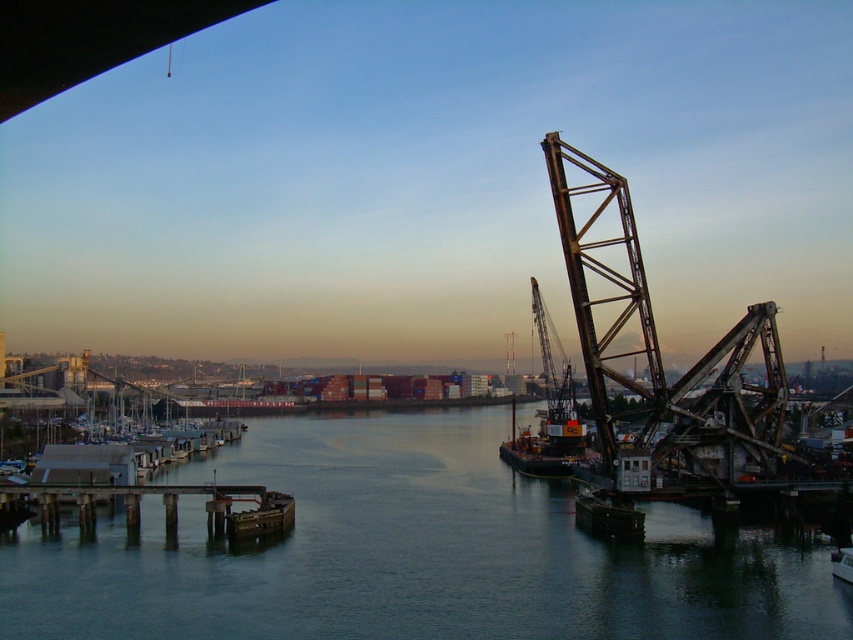
You are a photographer trying to capture the metallic gray crane at center right in your shot. You want to ensure that the dark blue water at center doesn

The dark blue water at center is shorter than the metallic gray crane at center right, so the crane will appear taller than the water in the photograph.

You are standing at the waterfront and want to take a photo of both the dark blue water at center and the metallic gray crane at center right. Since you want both to be in focus, you need to know which object is closer to you. Which one is closer?

The dark blue water at center is closer to the viewer than the metallic gray crane at center right, so you should focus on the dark blue water at center first to ensure both are in focus.

You are standing at the point with coordinates point (648, 554) and want to move towards point (550, 356). Given that you can only move forward in a straight line, will you be moving towards or away from the large metal structure on the right side of the image?

Since point (648, 554) is closer to the viewer than point (550, 356), moving from point (648, 554) towards point (550, 356) would mean moving away from the large metal structure on the right side of the image.